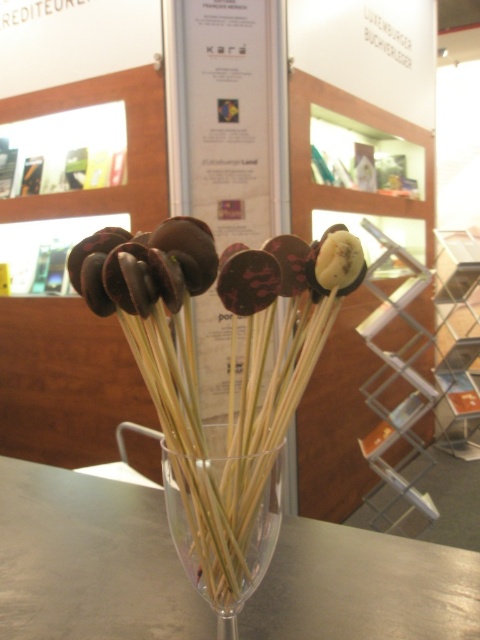
Question: Does transparent glass vase at center have a lesser width compared to chocolate-coated banana at center?

Choices:
 (A) yes
 (B) no

Answer: (B)

Question: Which point appears closest to the camera in this image?

Choices:
 (A) (236, 291)
 (B) (23, 580)
 (C) (264, 516)

Answer: (A)

Question: Estimate the real-world distances between objects in this image. Which object is closer to the transparent glass table at center?

Choices:
 (A) chocolate-coated banana at center
 (B) transparent glass vase at center

Answer: (B)

Question: Which of the following is the closest to the observer?

Choices:
 (A) (260, 275)
 (B) (192, 557)
 (C) (425, 624)

Answer: (A)

Question: Is transparent glass table at center to the right of chocolate-coated banana at center from the viewer's perspective?

Choices:
 (A) no
 (B) yes

Answer: (A)

Question: Does transparent glass table at center lie behind transparent glass vase at center?

Choices:
 (A) no
 (B) yes

Answer: (B)